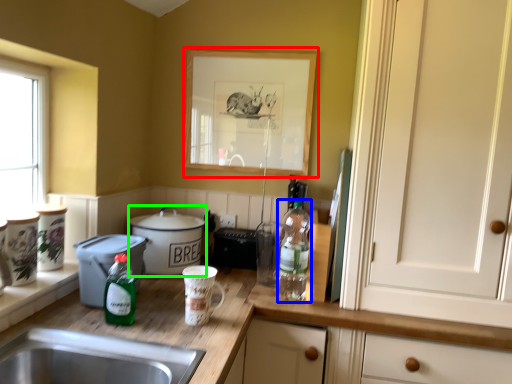
Question: Which object is the closest to the picture frame (highlighted by a red box)? Choose among these: bottle (highlighted by a blue box) or cooker (highlighted by a green box).

Choices:
 (A) bottle
 (B) cooker

Answer: (A)